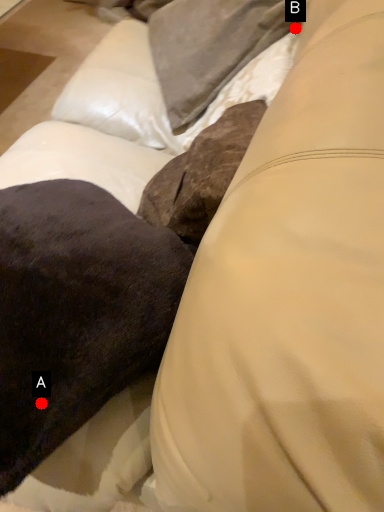
Question: Two points are circled on the image, labeled by A and B beside each circle. Which of the following is the farthest from the observer?

Choices:
 (A) A is further
 (B) B is further

Answer: (B)